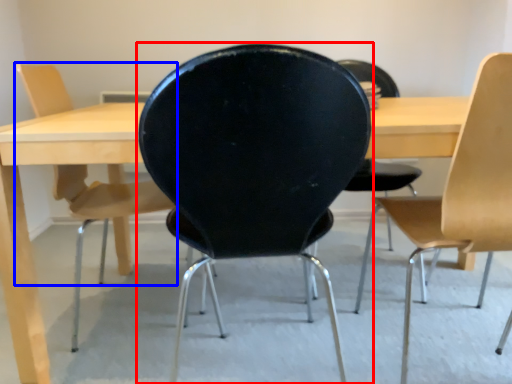
Question: Which object is further to the camera taking this photo, chair (highlighted by a red box) or chair (highlighted by a blue box)?

Choices:
 (A) chair
 (B) chair

Answer: (B)